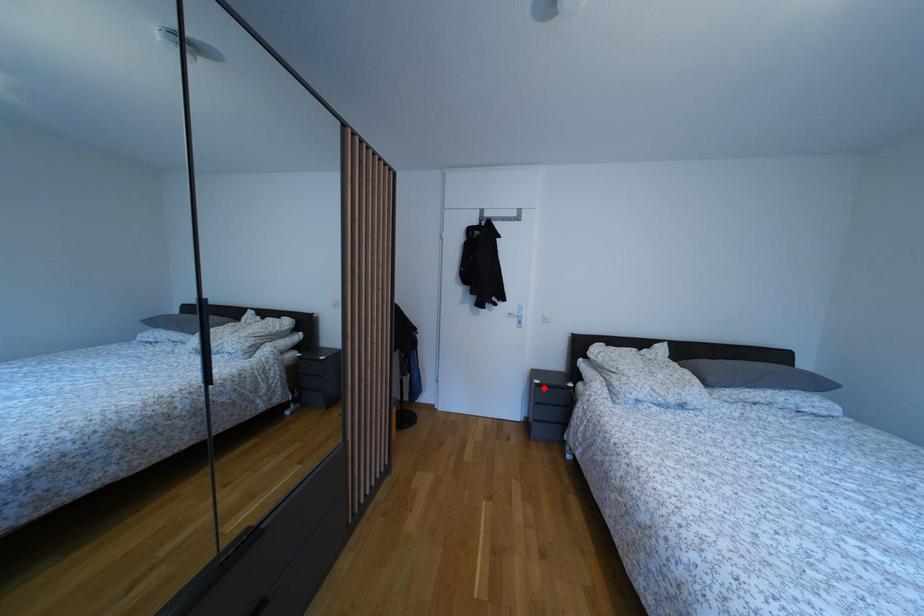
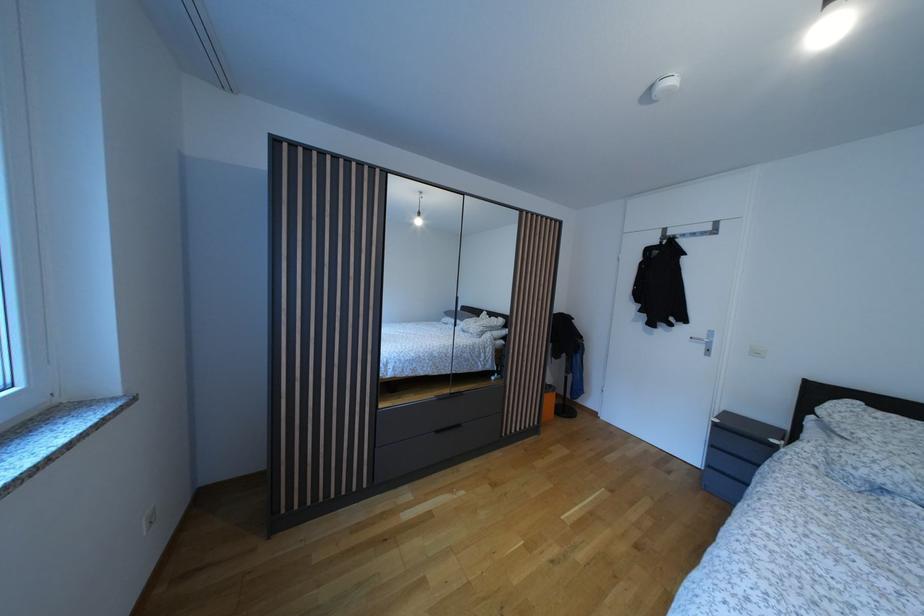
Question: I am providing you with two images of the same scene from different viewpoints. A red point is marked on the first image. At the location where the point appears in image 1, is it still visible in image 2?

Choices:
 (A) Yes
 (B) No

Answer: (A)